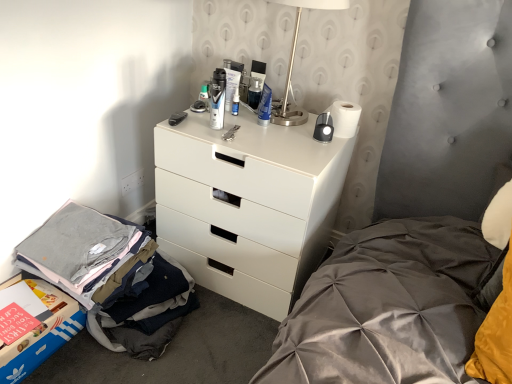
You are a GUI agent. You are given a task and a screenshot of the screen. Output one action in this format:
    pyautogui.click(x=<x>, y=<y>)
    Task: Click on the free spot to the right of blue glossy bottle at center, the second toiletry viewed from the right
    This screenshot has height=384, width=512.
    Given the screenshot: What is the action you would take?
    pyautogui.click(x=280, y=120)